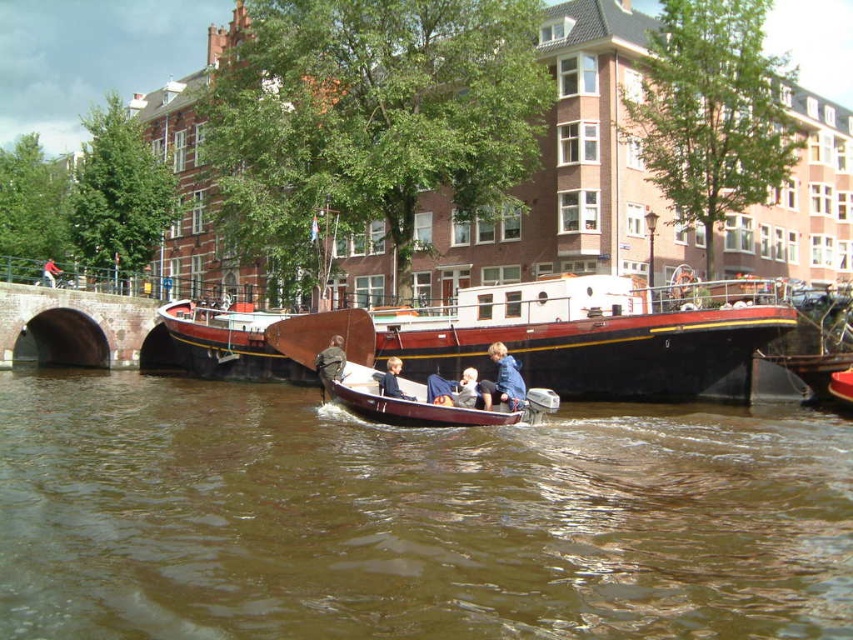
You are a tourist standing on the bank of the canal and want to take a photo that includes both the dark brown stone bridge at lower left and the red fabric cap at upper center. Which object should you position closer to the edge of your camera frame to ensure both are fully visible?

You should position the dark brown stone bridge at lower left closer to the edge of your camera frame because it is wider than the red fabric cap at upper center, allowing more space for both objects within the frame.

You are a tourist standing on the dark brown stone bridge at lower left and want to take a photo of the smooth beige baby at center. Is the bridge blocking your view of the baby?

The dark brown stone bridge at lower left is positioned over smooth beige baby at center, so the bridge is blocking your view of the smooth beige baby at center.